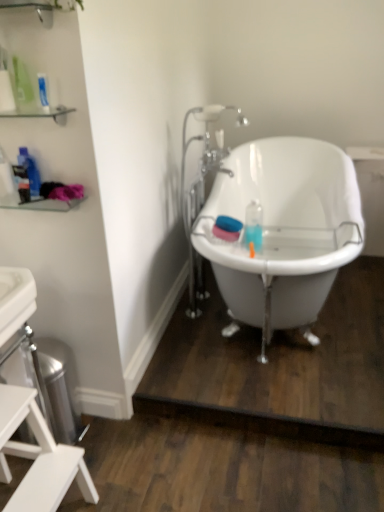
I want to click on vacant space underneath clear glass shelf at upper left (from a real-world perspective), so click(x=102, y=441).